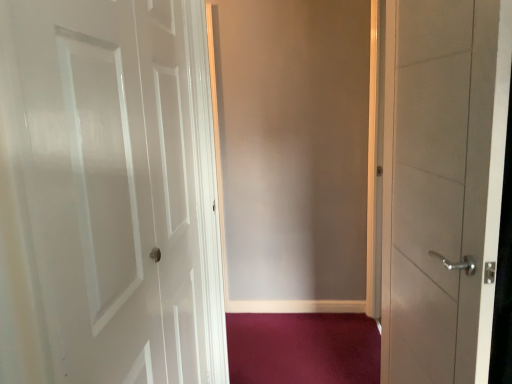
Describe the element at coordinates (292, 151) in the screenshot. Image resolution: width=512 pixels, height=384 pixels. I see `matte gray screen door at center` at that location.

The height and width of the screenshot is (384, 512). Identify the location of matte gray screen door at center. (292, 151).

Would you say purple carpet at lower center is inside or outside matte gray screen door at center?

purple carpet at lower center is outside matte gray screen door at center.

Considering the relative sizes of purple carpet at lower center and matte gray screen door at center in the image provided, is purple carpet at lower center shorter than matte gray screen door at center?

Yes, purple carpet at lower center is shorter than matte gray screen door at center.

From a real-world perspective, does purple carpet at lower center stand above matte gray screen door at center?

Actually, purple carpet at lower center is physically below matte gray screen door at center in the real world.

Considering the positions of point (362, 369) and point (278, 233), is point (362, 369) closer or farther from the camera than point (278, 233)?

Point (362, 369) is positioned closer to the camera compared to point (278, 233).

Is satin white door at right, arranged as the second door when viewed from the left, facing away from matte gray screen door at center?

No, satin white door at right, arranged as the second door when viewed from the left,'s orientation is not away from matte gray screen door at center.

Can you confirm if satin white door at right, marked as the first door in a right-to-left arrangement, is shorter than matte gray screen door at center?

Indeed, satin white door at right, marked as the first door in a right-to-left arrangement, has a lesser height compared to matte gray screen door at center.

From the image's perspective, which is above, satin white door at right, marked as the first door in a right-to-left arrangement, or matte gray screen door at center?

matte gray screen door at center appears higher in the image.

From a real-world perspective, is matte gray screen door at center on top of satin white door at right, arranged as the second door when viewed from the left?

Incorrect, from a real-world perspective, matte gray screen door at center is lower than satin white door at right, arranged as the second door when viewed from the left.

Considering the relative sizes of matte gray screen door at center and satin white door at right, marked as the first door in a right-to-left arrangement, in the image provided, is matte gray screen door at center wider than satin white door at right, marked as the first door in a right-to-left arrangement,?

No.

Considering the positions of objects matte gray screen door at center and satin white door at right, marked as the first door in a right-to-left arrangement, in the image provided, who is more to the right, matte gray screen door at center or satin white door at right, marked as the first door in a right-to-left arrangement,?

satin white door at right, marked as the first door in a right-to-left arrangement, is more to the right.

From a real-world perspective, relative to white glossy door at left, the first door in the left-to-right sequence, is satin white door at right, arranged as the second door when viewed from the left, vertically above or below?

In terms of real-world spatial position, satin white door at right, arranged as the second door when viewed from the left, is below white glossy door at left, the first door in the left-to-right sequence.

Identify the location of door on the left of satin white door at right, marked as the first door in a right-to-left arrangement. The image size is (512, 384). (109, 194).

Is satin white door at right, arranged as the second door when viewed from the left, wider than white glossy door at left, the first door in the left-to-right sequence?

Correct, the width of satin white door at right, arranged as the second door when viewed from the left, exceeds that of white glossy door at left, the first door in the left-to-right sequence.

From a real-world perspective, count 2nd doors upward from the matte gray screen door at center and point to it. Please provide its 2D coordinates.

[(109, 194)]

Which point is more distant from viewer, [248,246] or [168,339]?

Positioned behind is point [248,246].

Which of these two, matte gray screen door at center or white glossy door at left, the first door in the left-to-right sequence, is smaller?

Smaller between the two is matte gray screen door at center.

Is white glossy door at left, the second door from the right, located within matte gray screen door at center?

No, matte gray screen door at center does not contain white glossy door at left, the second door from the right.

How distant is white glossy door at left, the second door from the right, from matte gray screen door at center?

The distance of white glossy door at left, the second door from the right, from matte gray screen door at center is 4.03 feet.

Considering the positions of point (214, 379) and point (340, 187), is point (214, 379) closer or farther from the camera than point (340, 187)?

Point (214, 379) is positioned closer to the camera compared to point (340, 187).

From a real-world perspective, who is located lower, white glossy door at left, the first door in the left-to-right sequence, or matte gray screen door at center?

matte gray screen door at center.

How different are the orientations of white glossy door at left, the first door in the left-to-right sequence, and matte gray screen door at center in degrees?

white glossy door at left, the first door in the left-to-right sequence, and matte gray screen door at center are facing 90.3 degrees away from each other.

From a real-world perspective, which object rests below the other?

purple carpet at lower center.

Which object is further away from the camera taking this photo, purple carpet at lower center or white glossy door at left, the second door from the right?

purple carpet at lower center.

From the image's perspective, is purple carpet at lower center located beneath white glossy door at left, the second door from the right?

Yes, from the image's perspective, purple carpet at lower center is beneath white glossy door at left, the second door from the right.

Is point (267, 358) closer to viewer compared to point (73, 89)?

No, it is not.

Where is `screen door that appears on the left of purple carpet at lower center`? screen door that appears on the left of purple carpet at lower center is located at coordinates (292, 151).

I want to click on door that is the 1st one when counting downward from the matte gray screen door at center (from the image's perspective), so click(442, 185).

From the image, which object appears to be farther from satin white door at right, marked as the first door in a right-to-left arrangement, purple carpet at lower center or matte gray screen door at center?

matte gray screen door at center.

Looking at the image, which one is located further to white glossy door at left, the first door in the left-to-right sequence, matte gray screen door at center or purple carpet at lower center?

The object further to white glossy door at left, the first door in the left-to-right sequence, is matte gray screen door at center.

Consider the image. When comparing their distances from matte gray screen door at center, does purple carpet at lower center or satin white door at right, marked as the first door in a right-to-left arrangement, seem closer?

purple carpet at lower center.

Considering their positions, is purple carpet at lower center positioned closer to white glossy door at left, the second door from the right, than matte gray screen door at center?

Among the two, purple carpet at lower center is located nearer to white glossy door at left, the second door from the right.

Which object lies nearer to the anchor point satin white door at right, marked as the first door in a right-to-left arrangement, purple carpet at lower center or white glossy door at left, the second door from the right?

The object closer to satin white door at right, marked as the first door in a right-to-left arrangement, is white glossy door at left, the second door from the right.

When comparing their distances from matte gray screen door at center, does white glossy door at left, the second door from the right, or purple carpet at lower center seem closer?

purple carpet at lower center is closer to matte gray screen door at center.

Looking at the image, which one is located closer to white glossy door at left, the second door from the right, satin white door at right, arranged as the second door when viewed from the left, or purple carpet at lower center?

Among the two, satin white door at right, arranged as the second door when viewed from the left, is located nearer to white glossy door at left, the second door from the right.

Estimate the real-world distances between objects in this image. Which object is closer to matte gray screen door at center, purple carpet at lower center or white glossy door at left, the first door in the left-to-right sequence?

purple carpet at lower center is closer to matte gray screen door at center.

You are a GUI agent. You are given a task and a screenshot of the screen. Output one action in this format:
    pyautogui.click(x=<x>, y=<y>)
    Task: Click on the door between white glossy door at left, the second door from the right, and matte gray screen door at center from front to back
    This screenshot has width=512, height=384.
    Given the screenshot: What is the action you would take?
    pyautogui.click(x=442, y=185)

Identify the location of screen door located between white glossy door at left, the second door from the right, and purple carpet at lower center in the depth direction. click(292, 151).

The height and width of the screenshot is (384, 512). Identify the location of screen door between satin white door at right, arranged as the second door when viewed from the left, and purple carpet at lower center from front to back. (292, 151).

I want to click on door between white glossy door at left, the first door in the left-to-right sequence, and purple carpet at lower center from front to back, so click(x=442, y=185).